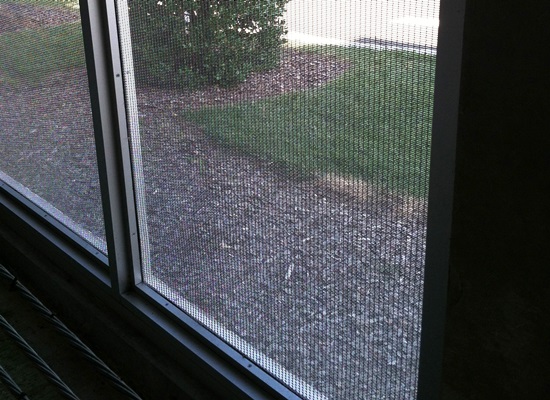
This screenshot has width=550, height=400. I want to click on 1 black colored wall on the right, so click(x=521, y=136).